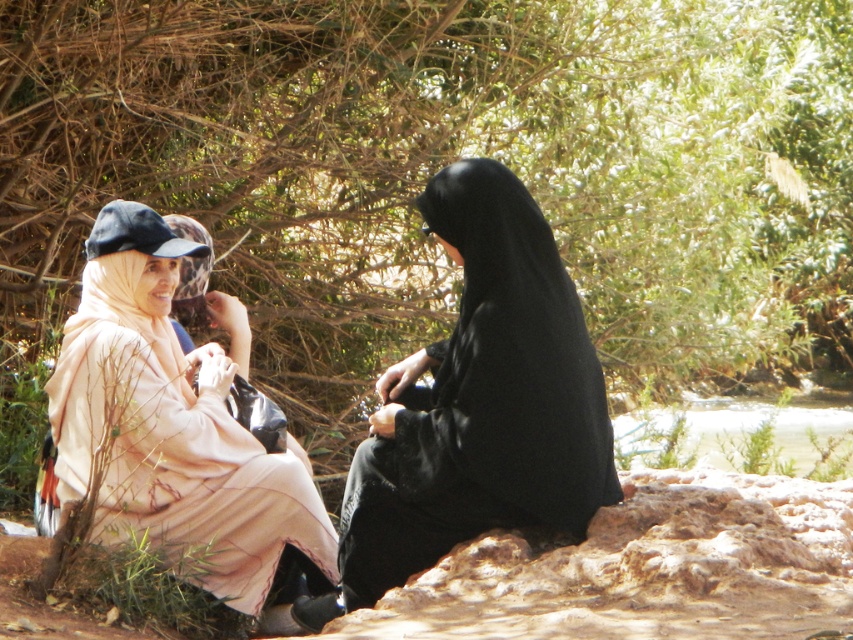
Does black matte dress at center come behind clear water at creek right?

No, black matte dress at center is closer to the viewer.

Where is `black matte dress at center`? The height and width of the screenshot is (640, 853). black matte dress at center is located at coordinates coord(479,403).

The image size is (853, 640). Find the location of `black matte dress at center`. black matte dress at center is located at coordinates (479, 403).

Find the location of `brown textured tree at upper center`. brown textured tree at upper center is located at coordinates (440, 168).

I want to click on brown textured tree at upper center, so click(x=440, y=168).

Locate an element on the screen. The width and height of the screenshot is (853, 640). brown textured tree at upper center is located at coordinates (440, 168).

Does black matte dress at center have a greater width compared to pale pink fabric at left?

Yes.

Is the position of black matte dress at center more distant than that of pale pink fabric at left?

No, it is in front of pale pink fabric at left.

Find the location of a particular element. The height and width of the screenshot is (640, 853). black matte dress at center is located at coordinates (479, 403).

Locate an element on the screen. This screenshot has height=640, width=853. black matte dress at center is located at coordinates (479, 403).